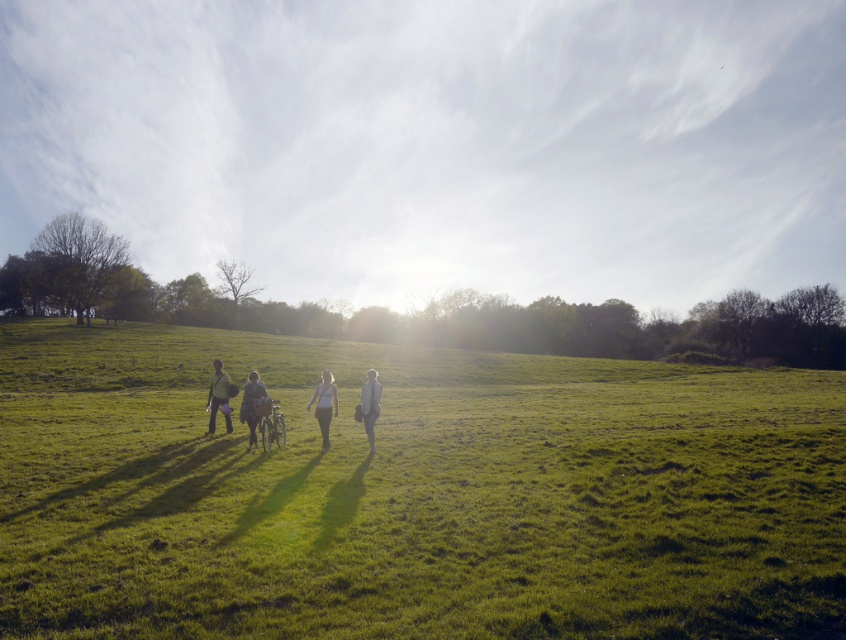
You are standing in the field and see the brown leather jacket at center and the green fabric shirt at center. Which clothing item is nearer to you?

The brown leather jacket at center is closer to the viewer than the green fabric shirt at center, so the brown leather jacket at center is nearer to you.